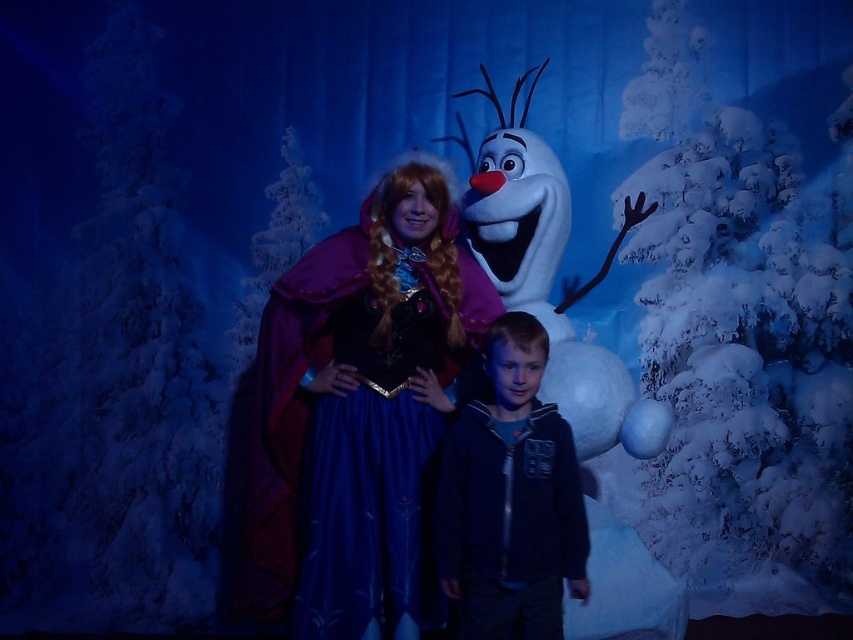
Question: Which object is positioned farthest from the velvet blue dress at center?

Choices:
 (A) dark blue zip-up hoodie at center
 (B) white fluffy snowman at center

Answer: (B)

Question: Is velvet blue dress at center wider than white fluffy snowman at center?

Choices:
 (A) yes
 (B) no

Answer: (A)

Question: Which point is farther to the camera?

Choices:
 (A) velvet blue dress at center
 (B) white fluffy snowman at center

Answer: (B)

Question: Does white fluffy snowman at center appear over dark blue zip-up hoodie at center?

Choices:
 (A) no
 (B) yes

Answer: (B)

Question: Which point appears farthest from the camera in this image?

Choices:
 (A) pos(560,477)
 (B) pos(625,556)

Answer: (B)

Question: Does white fluffy snowman at center have a smaller size compared to dark blue zip-up hoodie at center?

Choices:
 (A) no
 (B) yes

Answer: (A)